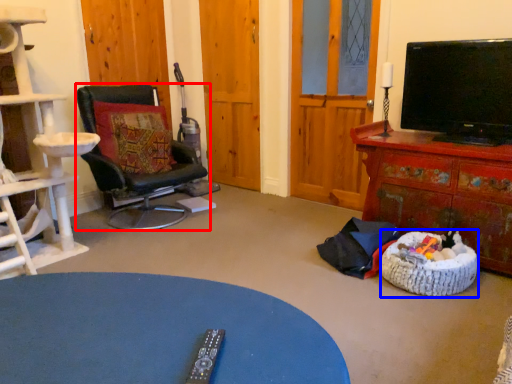
Question: Among these objects, which one is farthest to the camera, chair (highlighted by a red box) or dog bed (highlighted by a blue box)?

Choices:
 (A) chair
 (B) dog bed

Answer: (A)